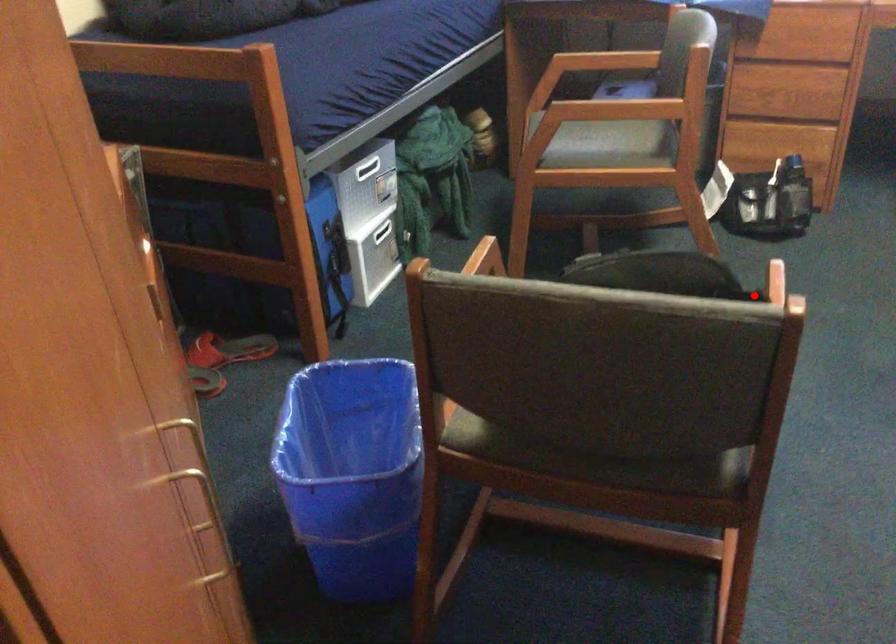
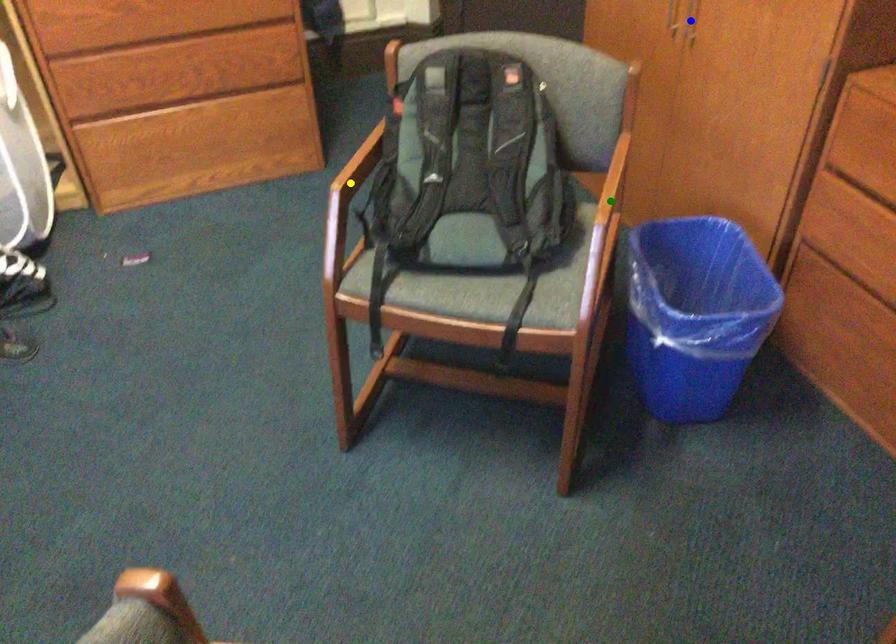
Question: I am providing you with two images of the same scene from different viewpoints. A red point is marked on the first image. You are given multiple points on the second image. Which point in image 2 represents the same 3d spot as the red point in image 1?

Choices:
 (A) yellow point
 (B) green point
 (C) blue point

Answer: (A)